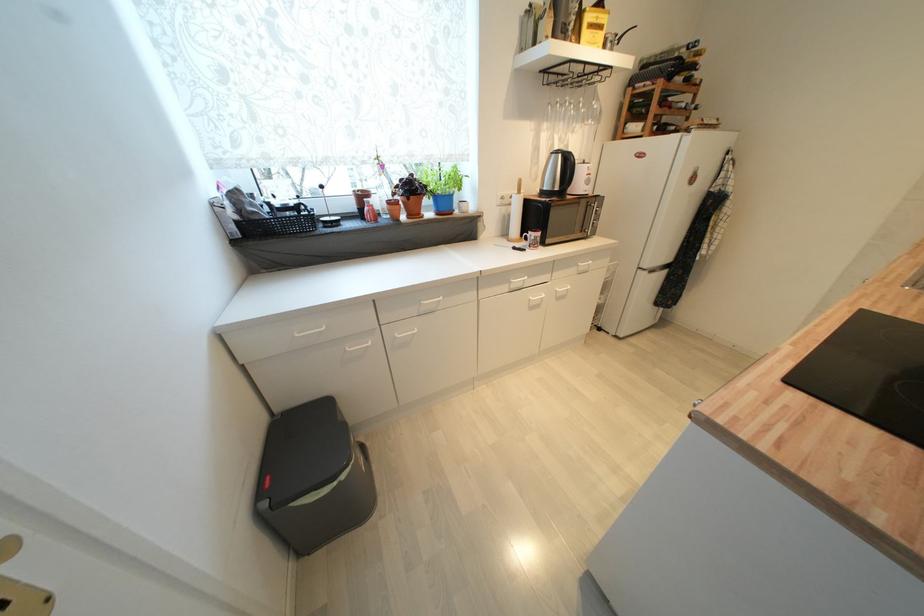
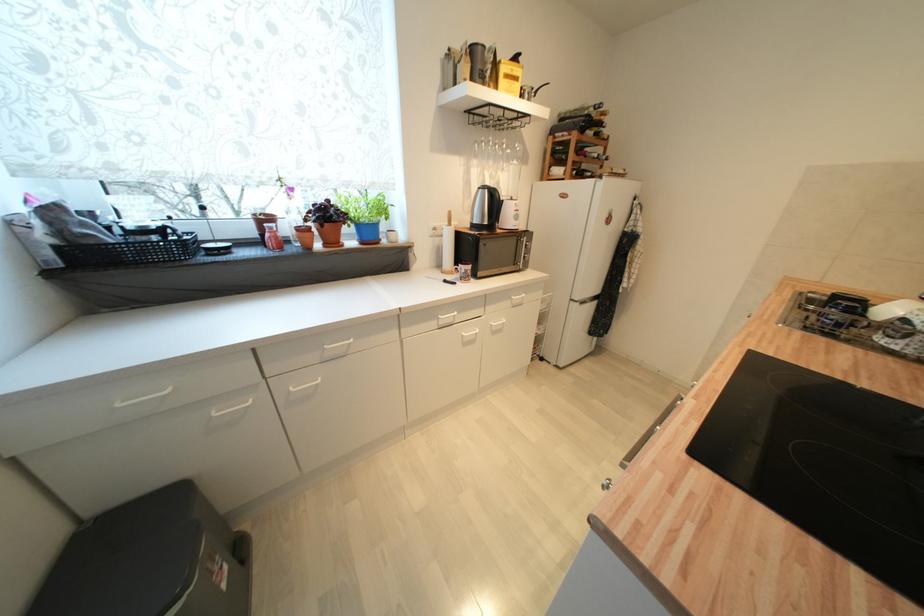
Find the pixel in the second image that matches the point at 551,127 in the first image.

(480, 164)